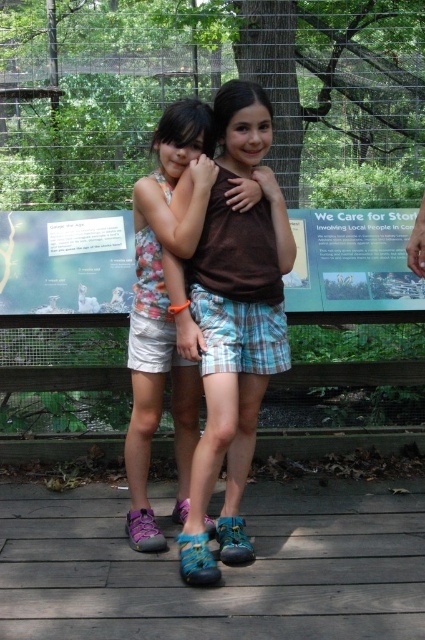
Question: Which point is closer to the camera taking this photo?

Choices:
 (A) (176, 376)
 (B) (209, 449)

Answer: (B)

Question: Does brown cotton shirt at center come behind floral fabric dress at center?

Choices:
 (A) yes
 (B) no

Answer: (B)

Question: Which of the following is the closest to the observer?

Choices:
 (A) (181, 269)
 (B) (133, 436)

Answer: (A)

Question: Does brown cotton shirt at center lie behind floral fabric dress at center?

Choices:
 (A) no
 (B) yes

Answer: (A)

Question: Does brown cotton shirt at center have a smaller size compared to floral fabric dress at center?

Choices:
 (A) no
 (B) yes

Answer: (A)

Question: Which point is closer to the camera?

Choices:
 (A) (254, 321)
 (B) (170, 150)

Answer: (A)